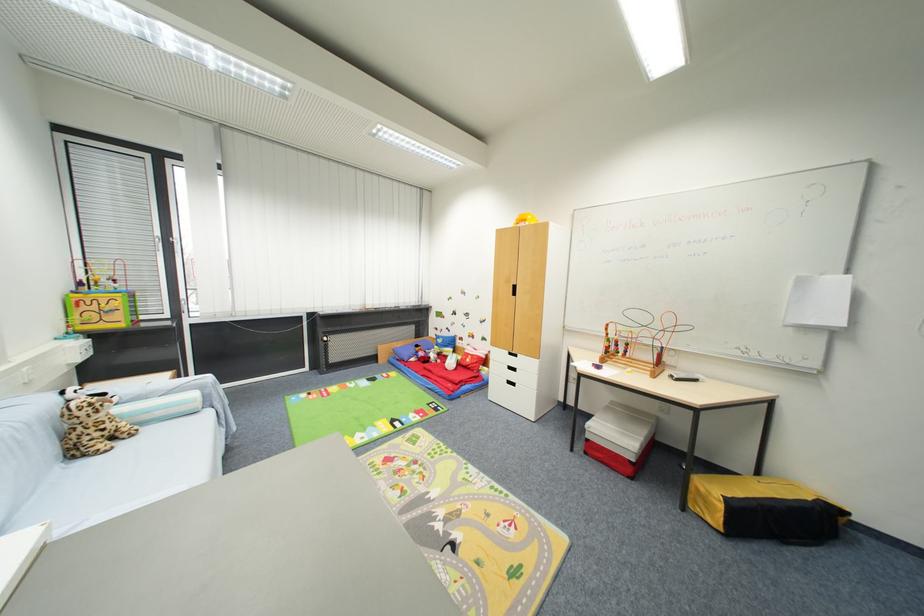
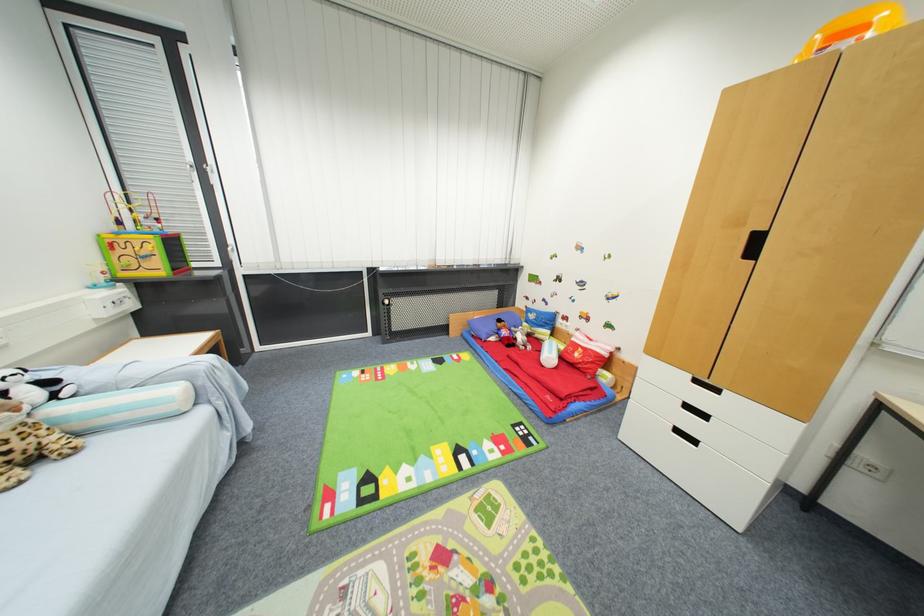
In the second image, find the point that corresponds to pixel 519 294 in the first image.

(757, 254)